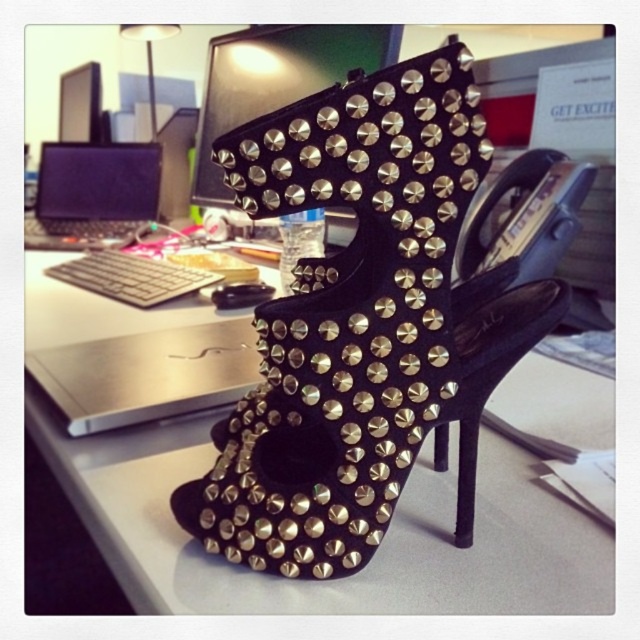
From the picture: Does metallic studded shoe at upper center appear under black matte laptop at left?

No.

Can you confirm if metallic studded shoe at upper center is shorter than black matte laptop at left?

No, metallic studded shoe at upper center is not shorter than black matte laptop at left.

Is point (205, 124) positioned behind point (54, 225)?

That is False.

Where is `metallic studded shoe at upper center`? Image resolution: width=640 pixels, height=640 pixels. metallic studded shoe at upper center is located at coordinates (276, 80).

Is point (403, 433) closer to viewer compared to point (40, 419)?

Yes, it is.

Is black suede studded sandal at center positioned before black matte desk at center?

Yes, it is in front of black matte desk at center.

Is point (230, 164) closer to viewer compared to point (77, 488)?

That is True.

Identify the location of black suede studded sandal at center. (362, 321).

Is black suede studded sandal at center shorter than black matte laptop at left?

Incorrect, black suede studded sandal at center's height does not fall short of black matte laptop at left's.

Looking at this image, between black suede studded sandal at center and black matte laptop at left, which one is positioned lower?

black suede studded sandal at center is lower down.

Measure the distance between point [198,518] and camera.

Point [198,518] and camera are 24.92 inches apart.

This screenshot has width=640, height=640. In order to click on black suede studded sandal at center in this screenshot , I will do `click(362, 321)`.